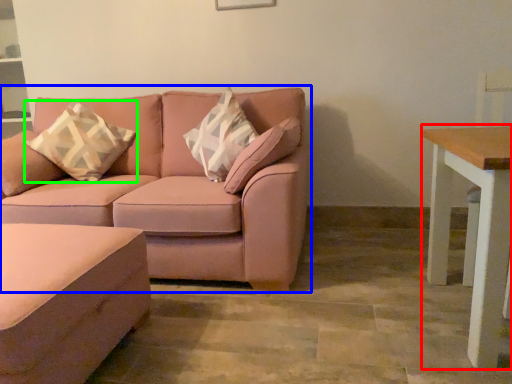
Question: Considering the real-world distances, which object is closest to table (highlighted by a red box)? studio couch (highlighted by a blue box) or throw pillow (highlighted by a green box).

Choices:
 (A) studio couch
 (B) throw pillow

Answer: (A)